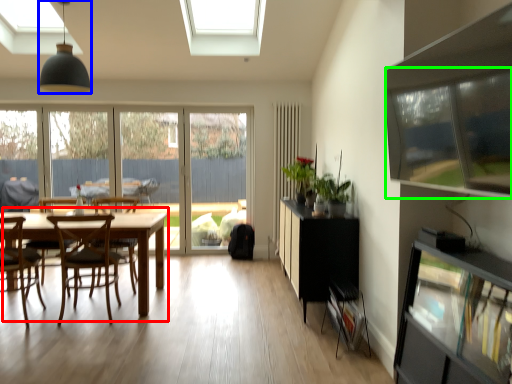
Question: Which object is the closest to the kitchen & dining room table (highlighted by a red box)? Choose among these: light fixture (highlighted by a blue box) or window screen (highlighted by a green box).

Choices:
 (A) light fixture
 (B) window screen

Answer: (A)